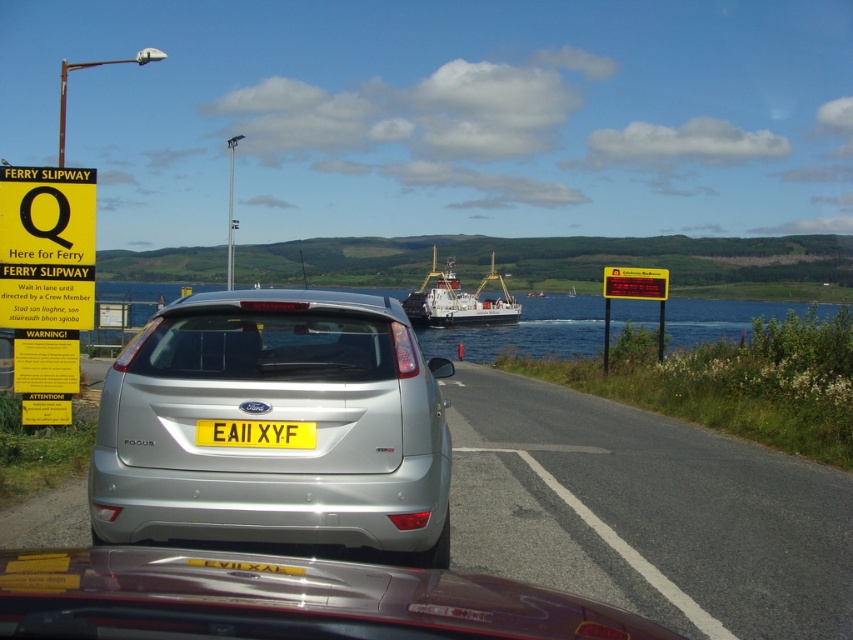
Question: Among these points, which one is farthest from the camera?

Choices:
 (A) (824, 593)
 (B) (19, 220)

Answer: (B)

Question: Which point is closer to the camera?

Choices:
 (A) asphalt road at center
 (B) silver metallic car at center
 (C) yellow plastic sign at right
 (D) shiny metallic car at center

Answer: (D)

Question: Is silver metallic hatchback at center behind yellow paper sign at left?

Choices:
 (A) no
 (B) yes

Answer: (A)

Question: Is clear blue water at center wider than yellow matte license plate at center?

Choices:
 (A) yes
 (B) no

Answer: (A)

Question: Considering the relative positions of asphalt road at center and yellow plastic sign at right in the image provided, where is asphalt road at center located with respect to yellow plastic sign at right?

Choices:
 (A) left
 (B) right

Answer: (A)

Question: Which point is farther to the camera?

Choices:
 (A) white matte ship at center
 (B) yellow paper sign at left

Answer: (A)